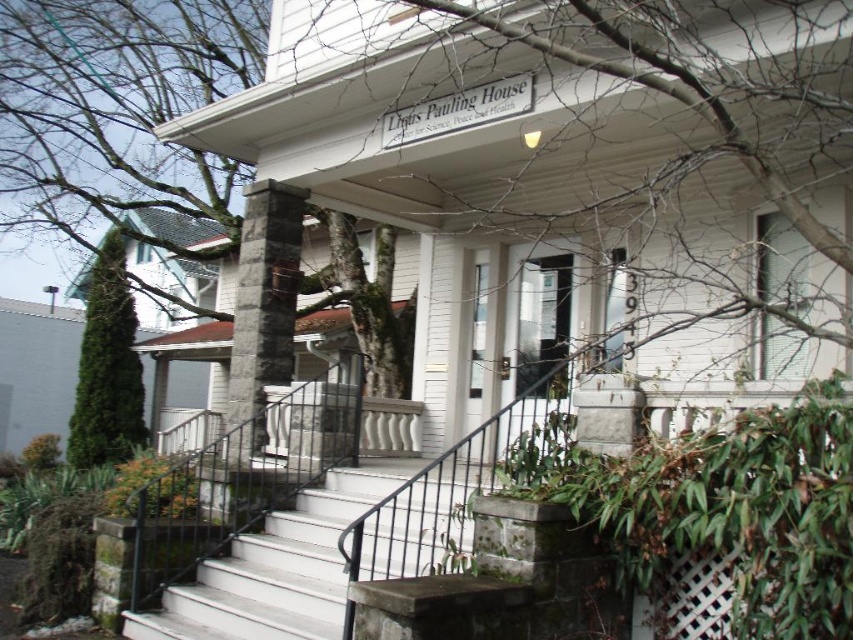
Question: Can you confirm if white painted concrete stairs at center is positioned to the left of green coniferous tree at left?

Choices:
 (A) yes
 (B) no

Answer: (B)

Question: From the image, what is the correct spatial relationship of white painted concrete stairs at center in relation to green coniferous tree at left?

Choices:
 (A) below
 (B) above

Answer: (A)

Question: In this image, where is white painted concrete stairs at center located relative to green coniferous tree at left?

Choices:
 (A) left
 (B) right

Answer: (B)

Question: Which point is farther to the camera?

Choices:
 (A) (100, 276)
 (B) (326, 600)

Answer: (A)